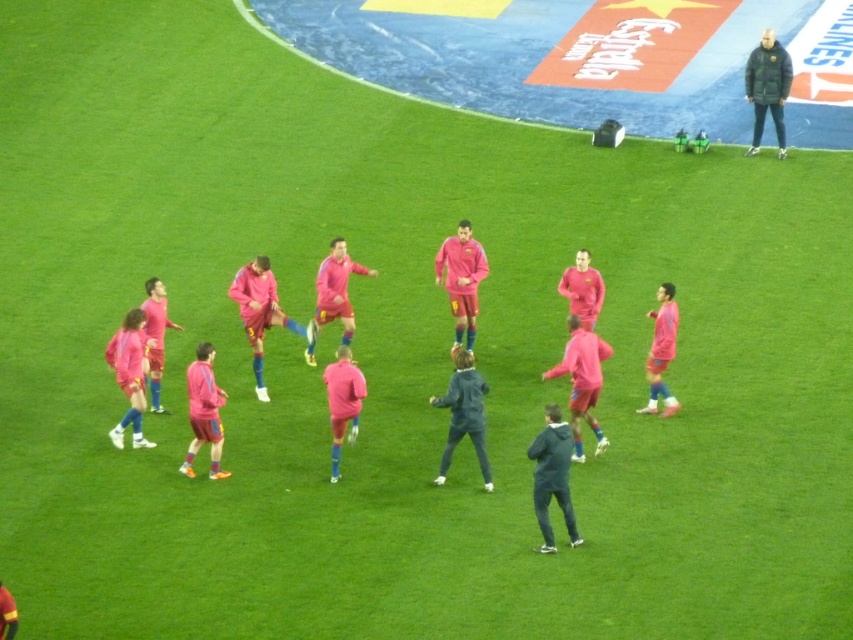
Can you confirm if dark green puffer jacket at upper right is shorter than pink matte jersey at center?

No.

Find the location of a particular element. The image size is (853, 640). dark green puffer jacket at upper right is located at coordinates (x=767, y=88).

Does point (764, 81) come in front of point (653, 342)?

No, (764, 81) is behind (653, 342).

Locate an element on the screen. dark green puffer jacket at upper right is located at coordinates (767, 88).

Is pink matte soccer uniforms at center bigger than pink matte jersey at center?

Yes.

Who is higher up, pink matte soccer uniforms at center or pink matte jersey at center?

pink matte jersey at center is higher up.

Find the location of a particular element. pink matte soccer uniforms at center is located at coordinates (582, 380).

I want to click on pink matte soccer uniforms at center, so click(x=582, y=380).

Find the location of a particular element. The width and height of the screenshot is (853, 640). pink matte soccer uniforms at center is located at coordinates (582, 380).